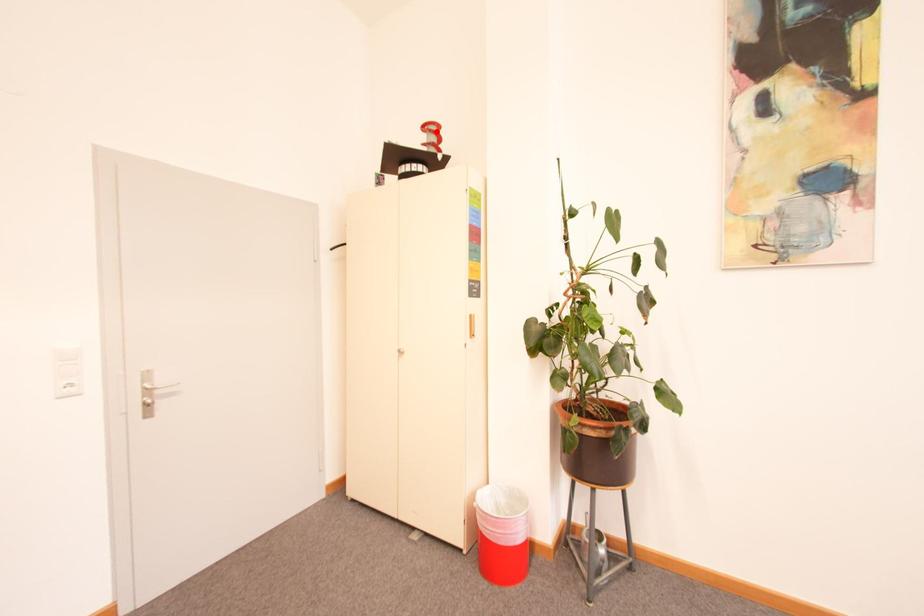
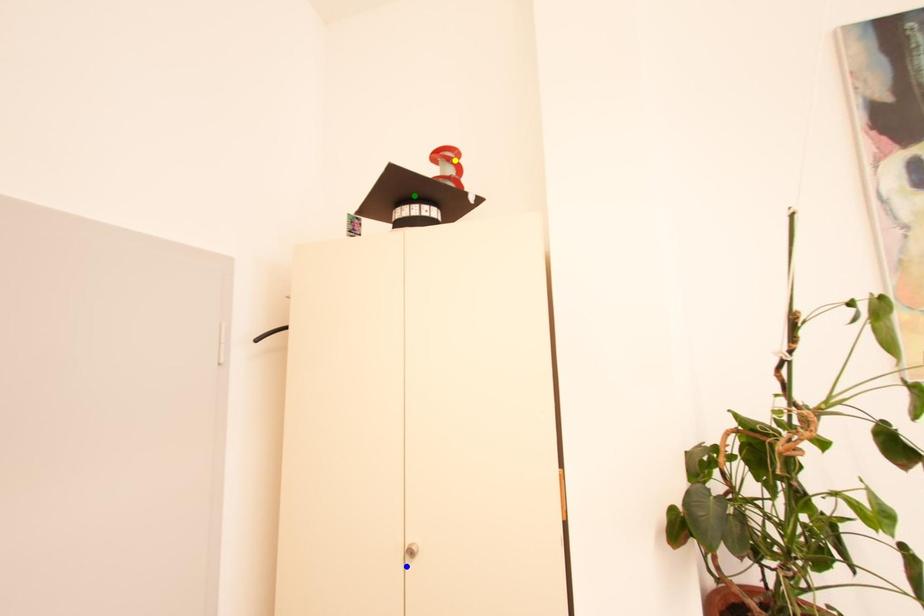
Question: I am providing you with two images of the same scene from different viewpoints. A red point is marked on the first image. You are given multiple points on the second image. In image 2, which mark is for the same physical point as the one in image 1?

Choices:
 (A) blue point
 (B) green point
 (C) yellow point

Answer: (C)